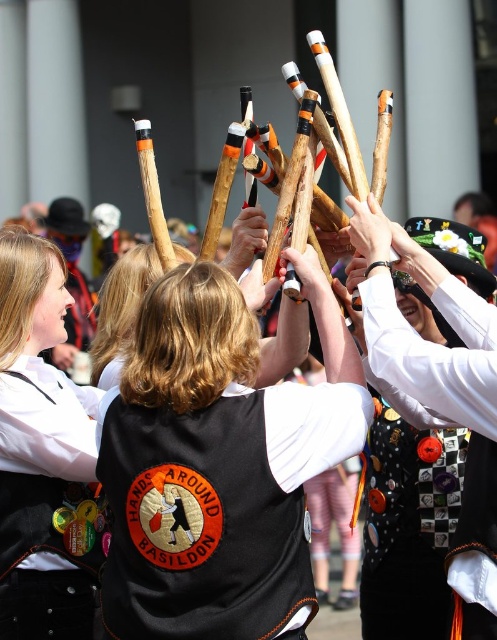
Where is the black fabric vest at center located in the image?

The black fabric vest at center is located at point 0.777 on the x axis and 0.453 on the y axis.

You are a photographer standing at the back of the crowd. You want to take a photo of the black fabric vest at center and the matte black vest at center so that both vests are fully visible in the frame. Which vest should you focus on to ensure the taller one is in focus?

The matte black vest at center is taller than the black fabric vest at center. To ensure the taller one is in focus, you should focus on the matte black vest at center.

You are observing the scene and want to take a photo of the black fabric vest at center and the matte black vest at center. Which vest will appear larger in your photo?

The black fabric vest at center will appear larger in the photo because it is closer to the viewer than the matte black vest at center.